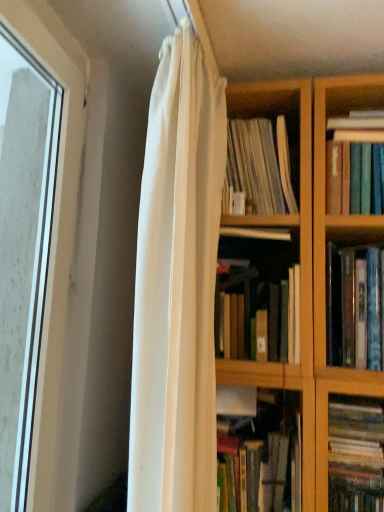
Question: Choose the correct answer: Is multicolored paperbacks at right, which is the first book in bottom-to-top order, inside white sheer curtain at center or outside it?

Choices:
 (A) outside
 (B) inside

Answer: (A)

Question: Relative to white sheer curtain at center, is multicolored paperbacks at right, arranged as the 5th book when viewed from the top, in front or behind?

Choices:
 (A) behind
 (B) front

Answer: (A)

Question: Which is farther from the hardcover books at right, placed as the 3th book when sorted from bottom to top?

Choices:
 (A) clear glass window at left
 (B) white sheer curtain at center
 (C) hardcover book at center, positioned as the 4th book in top-to-bottom order
 (D) multicolored paperbacks at right, which is the first book in bottom-to-top order
 (E) white paper at center, arranged as the second book when viewed from the top

Answer: (A)

Question: Which object is positioned closest to the white sheer curtain at center?

Choices:
 (A) hardcover books at right, which is the third book from top to bottom
 (B) clear glass window at left
 (C) hardcover book at center, the 2th book ordered from the bottom
 (D) white paper at center, the fourth book when ordered from bottom to top
 (E) hardcover book at upper right, acting as the fifth book starting from the bottom

Answer: (C)